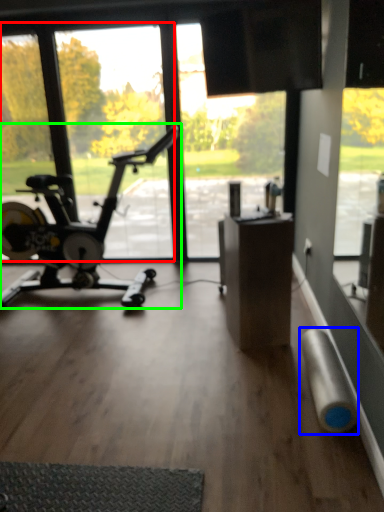
Question: Considering the real-world distances, which object is closest to window screen (highlighted by a red box)? duct tape (highlighted by a blue box) or stationary bicycle (highlighted by a green box).

Choices:
 (A) duct tape
 (B) stationary bicycle

Answer: (B)